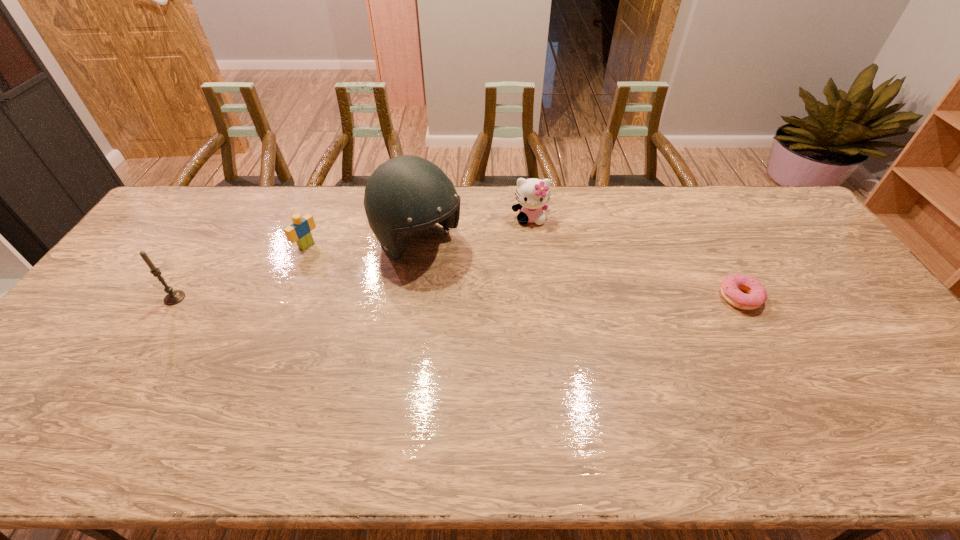
Identify the location of free spot that satisfies the following two spatial constraints: 1. on the back side of the fourth object from right to left; 2. on the right side of the kitten. Image resolution: width=960 pixels, height=540 pixels. (318, 218).